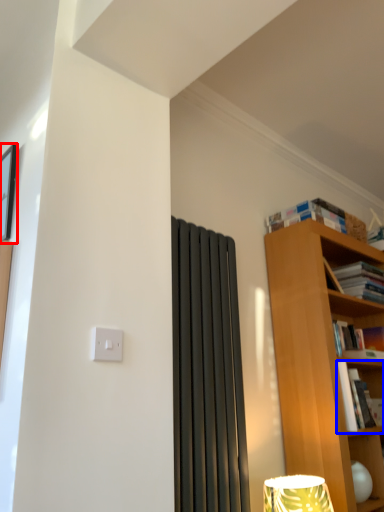
Question: Which point is further to the camera, picture frame (highlighted by a red box) or book (highlighted by a blue box)?

Choices:
 (A) picture frame
 (B) book

Answer: (B)